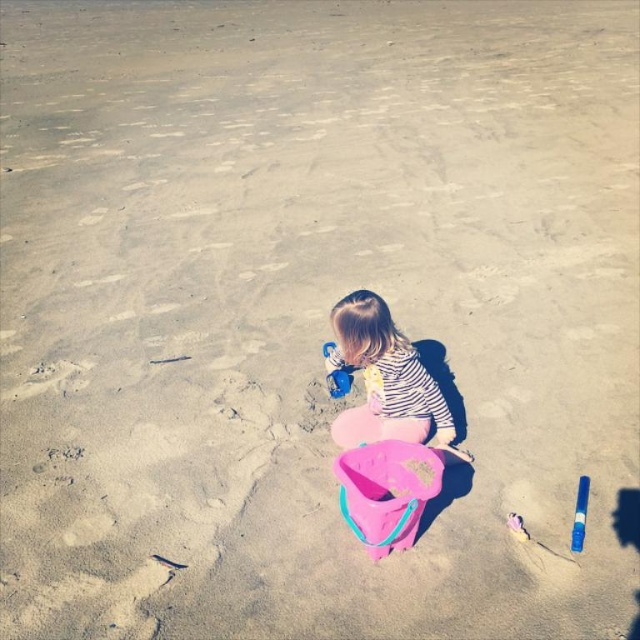
Based on the coordinates provided, which object corresponds to the location marked by the point at (385, 380)?

The point at (385, 380) corresponds to the striped fabric child at center.

You are a parent at the beach and want to ensure your child stays within a safe distance from the water. The blue plastic marker at lower right is placed to mark the boundary. Since the striped fabric child at center is currently facing away from the water, can you determine if the child is within the safe zone based on their positions?

The striped fabric child at center has a greater height compared to the blue plastic marker at lower right. Since the child is taller than the marker, they can likely see over it and might wander further, so it is advisable to keep a closer eye to ensure they stay within the safe zone marked by the blue plastic marker at lower right.

You are a parent watching your child at the beach. You have a blue plastic bucket at center and a striped fabric child at center. Which object takes up more space in the image?

The striped fabric child at center is bigger than the blue plastic bucket at center, so the child takes up more space in the image.